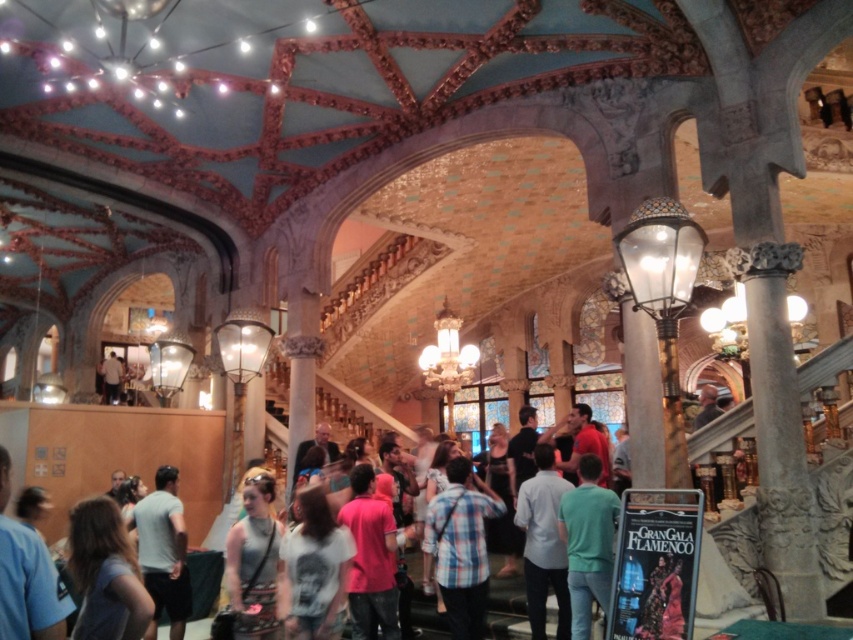
Question: Is plaid fabric shirt at center bigger than gray cotton t-shirt at lower left?

Choices:
 (A) yes
 (B) no

Answer: (B)

Question: Estimate the real-world distances between objects in this image. Which object is closer to the pink matte shirt at center?

Choices:
 (A) green matte shirt at center
 (B) gray cotton t-shirt at lower left
 (C) white matte shirt at center
 (D) plaid fabric shirt at center

Answer: (D)

Question: Is gray cotton shirt at lower left smaller than matte gray dress at center?

Choices:
 (A) no
 (B) yes

Answer: (B)

Question: Which of the following is the closest to the observer?

Choices:
 (A) gray cotton t-shirt at lower left
 (B) pink matte shirt at center
 (C) white matte shirt at center
 (D) plaid fabric shirt at center

Answer: (A)

Question: Which object is farther from the camera taking this photo?

Choices:
 (A) green matte shirt at center
 (B) matte gray dress at center
 (C) light gray cotton shirt at center
 (D) gray cotton t-shirt at lower left

Answer: (B)

Question: Does white matte shirt at center have a larger size compared to pink matte shirt at center?

Choices:
 (A) no
 (B) yes

Answer: (A)